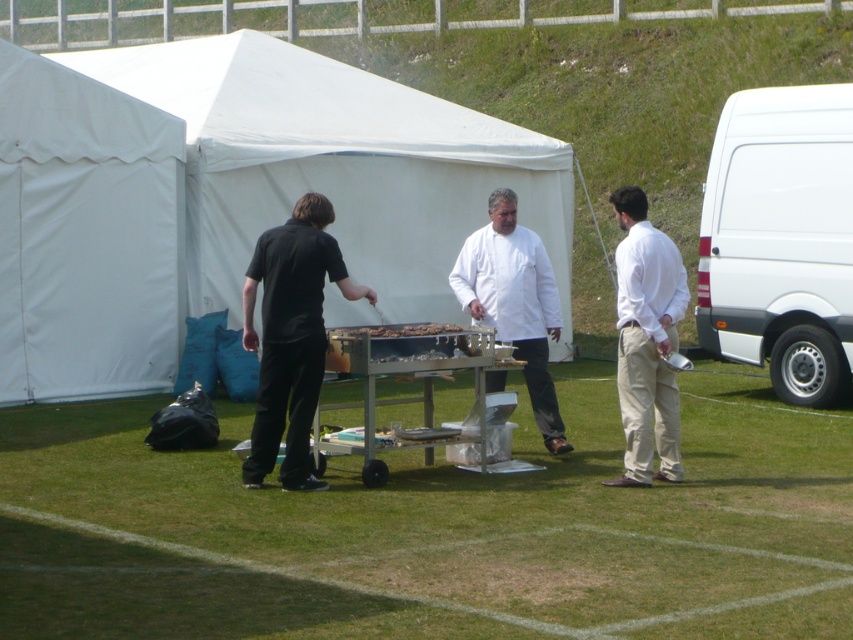
Who is shorter, black matte shirt at center or smooth wooden cutting board at center?

smooth wooden cutting board at center is shorter.

Where is `black matte shirt at center`? black matte shirt at center is located at coordinates (291, 337).

Locate an element on the screen. black matte shirt at center is located at coordinates (291, 337).

In the scene shown: Between white matte van at right and black matte shirt at center, which one has more height?

white matte van at right is taller.

Can you confirm if white matte van at right is positioned above black matte shirt at center?

Indeed, white matte van at right is positioned over black matte shirt at center.

Is point (838, 397) in front of point (289, 467)?

No, it is behind (289, 467).

The image size is (853, 640). I want to click on white matte van at right, so point(781,240).

Between white fabric tent at center and black matte shirt at center, which one is positioned higher?

white fabric tent at center is above.

Can you confirm if white fabric tent at center is thinner than black matte shirt at center?

Correct, white fabric tent at center's width is less than black matte shirt at center's.

The height and width of the screenshot is (640, 853). In order to click on white fabric tent at center in this screenshot , I will do `click(337, 166)`.